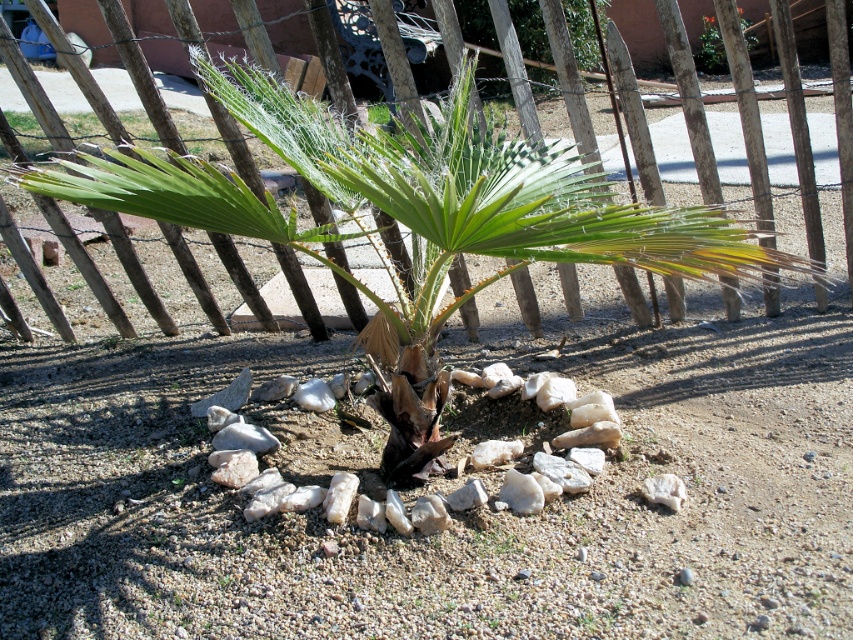
You are standing at the palm tree and want to walk to the point at coordinates point (x=828, y=140). Which direction should you walk relative to the point (x=720, y=44)?

You should walk towards the point (x=828, y=140), which is in front of the point (x=720, y=44).

You are a gardener checking the garden layout. You see the wooden at center and the green leafy plant at upper center. Which one is taller?

The wooden at center is much taller than the green leafy plant at upper center.

You are designing a garden layout and need to place the wooden at center and the green leafy plant at upper center. Considering their sizes, which object should be placed closer to the entrance to ensure visibility?

The wooden at center has a larger size compared to the green leafy plant at upper center. Therefore, placing the wooden at center closer to the entrance will make it more visible due to its larger size, while the smaller green leafy plant at upper center can be placed further back.